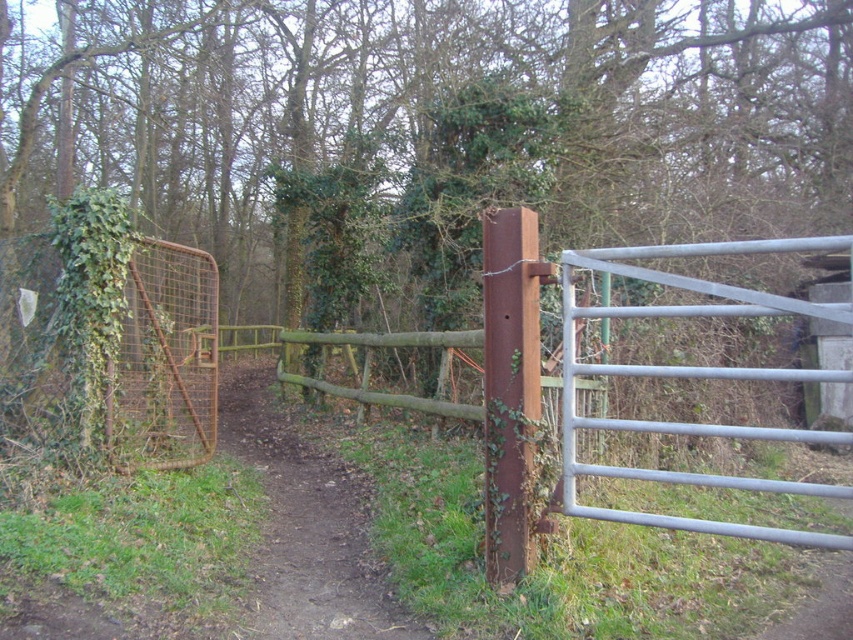
You are a hiker trying to determine the best route through the woods. You see the rusty metal gate at center and the brown dirt path at center. Which one is narrower?

The rusty metal gate at center is narrower than the brown dirt path at center.